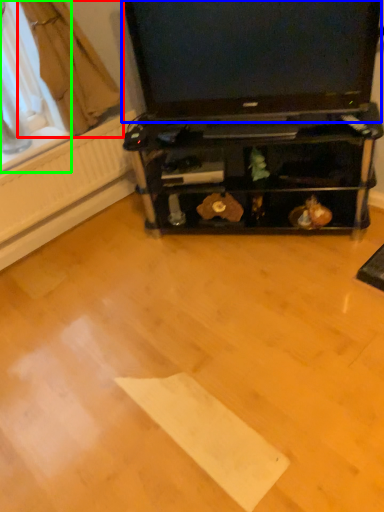
Question: Which is nearer to the curtain (highlighted by a red box)? television (highlighted by a blue box) or window screen (highlighted by a green box).

Choices:
 (A) television
 (B) window screen

Answer: (B)